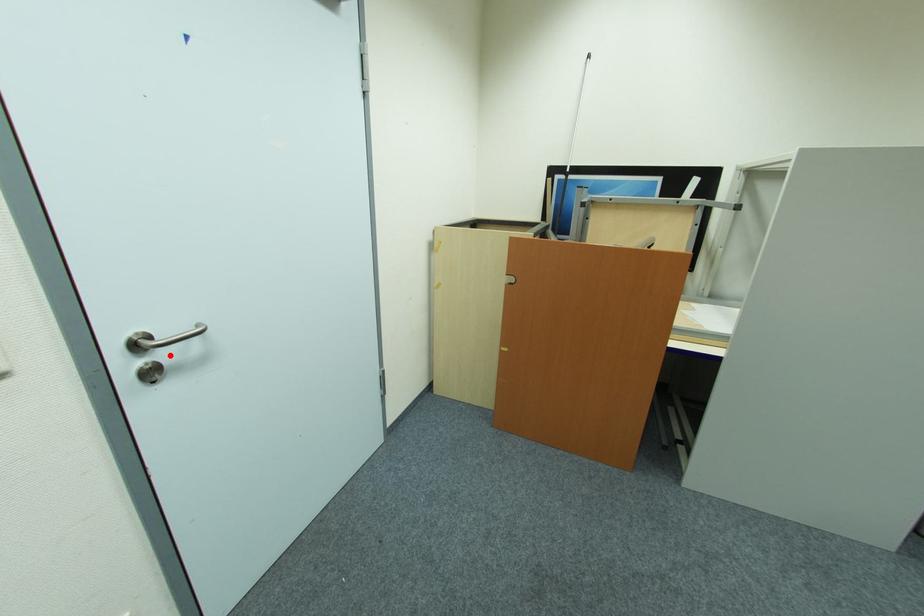
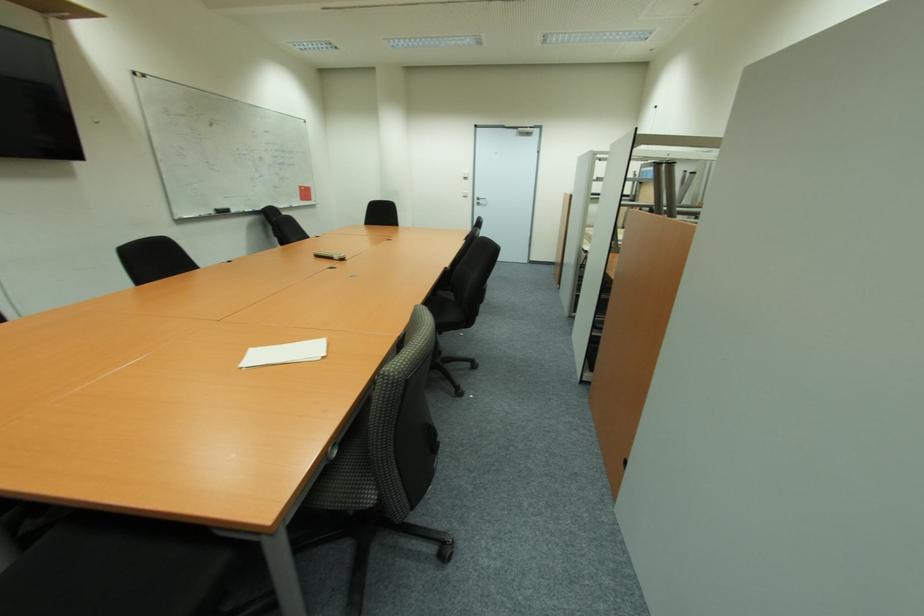
Locate, in the second image, the point that corresponds to the highlighted location in the first image.

(483, 203)